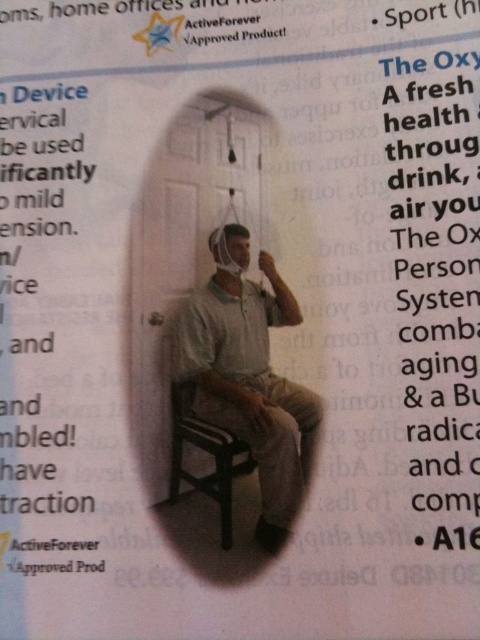
Consider the image. Can you confirm if matte white shirt at center is positioned to the left of wooden chair at lower center?

In fact, matte white shirt at center is to the right of wooden chair at lower center.

Does matte white shirt at center appear over wooden chair at lower center?

Yes.

You are a GUI agent. You are given a task and a screenshot of the screen. Output one action in this format:
    pyautogui.click(x=<x>, y=<y>)
    Task: Click on the matte white shirt at center
    The image size is (480, 640).
    Given the screenshot: What is the action you would take?
    pyautogui.click(x=249, y=376)

Where is `matte white shirt at center`? matte white shirt at center is located at coordinates (249, 376).